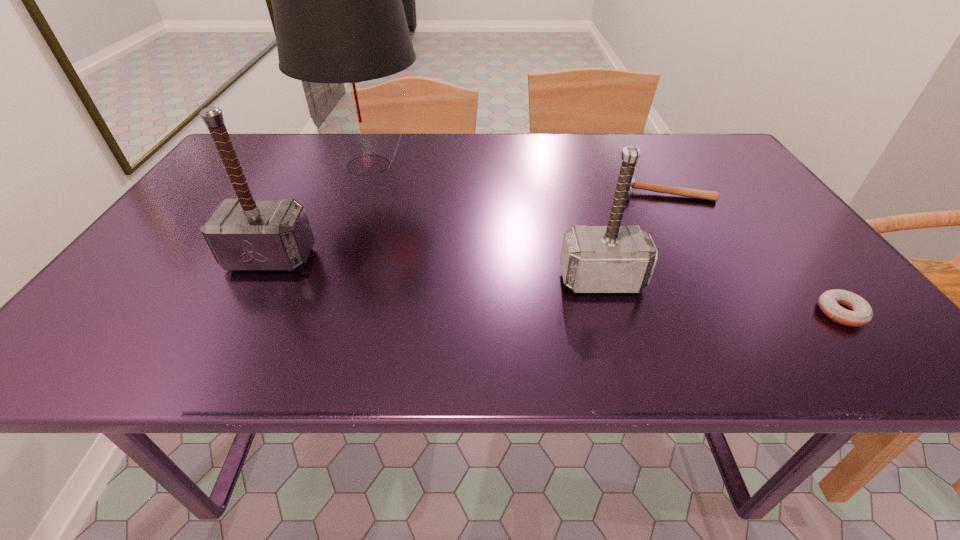
Identify the location of lampshade. (339, 20).

Identify the location of the leftmost hammer. (245, 234).

Image resolution: width=960 pixels, height=540 pixels. What are the coordinates of `the third object from right to left` in the screenshot? It's located at (595, 259).

You are a GUI agent. You are given a task and a screenshot of the screen. Output one action in this format:
    pyautogui.click(x=<x>, y=<y>)
    Task: Click on the rightmost hammer
    The width and height of the screenshot is (960, 540).
    Given the screenshot: What is the action you would take?
    (693, 193)

Where is `the fourth object from left to right`? the fourth object from left to right is located at coordinates (693, 193).

The height and width of the screenshot is (540, 960). Find the location of `the rightmost object`. the rightmost object is located at coordinates (860, 313).

Locate an element on the screen. free spot located 0.220m on the right of the lampshade is located at coordinates (503, 165).

Find the location of `free spot located on the right of the leftmost hammer`. free spot located on the right of the leftmost hammer is located at coordinates (340, 258).

This screenshot has height=540, width=960. Identify the location of vacant region located for striking with the head of the third object from right to left. (621, 347).

The image size is (960, 540). What are the coordinates of `vacant space situated 0.390m on the front of the rightmost hammer` in the screenshot? It's located at (737, 321).